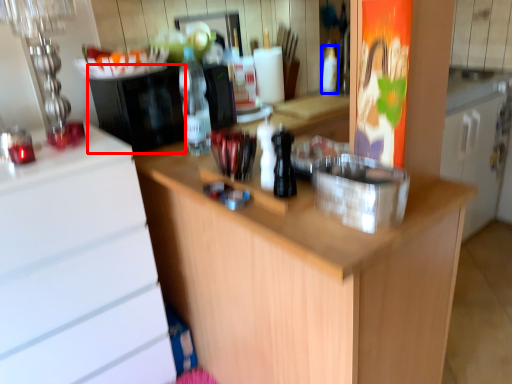
Question: Which point is further to the camera, appliance (highlighted by a red box) or bottle (highlighted by a blue box)?

Choices:
 (A) appliance
 (B) bottle

Answer: (B)